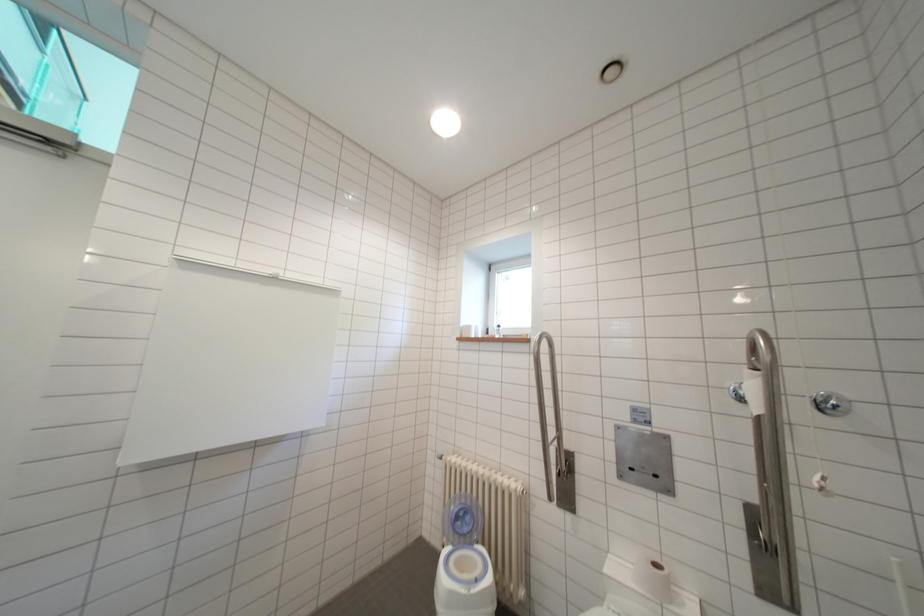
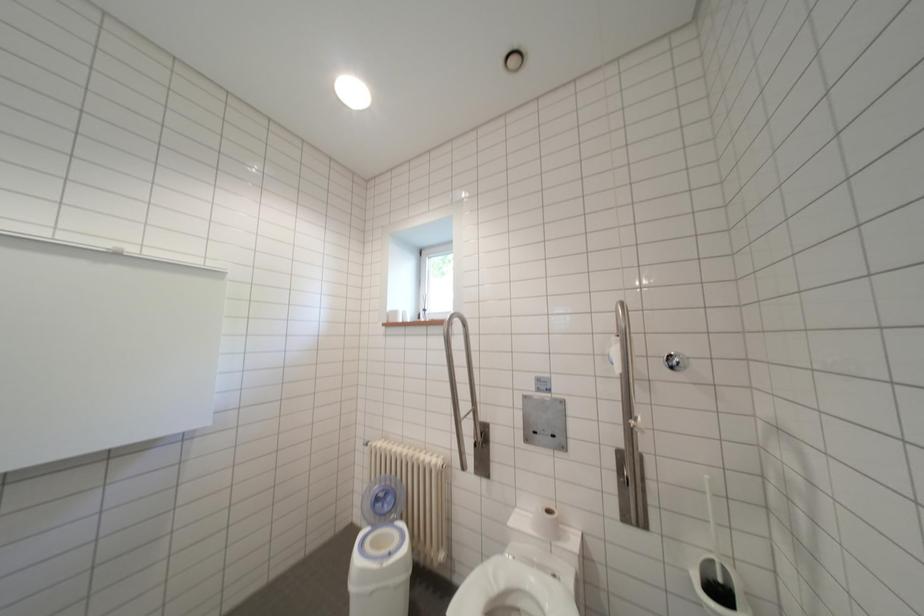
Question: How did the camera likely rotate?

Choices:
 (A) Left
 (B) Right
 (C) Up
 (D) Down

Answer: (B)